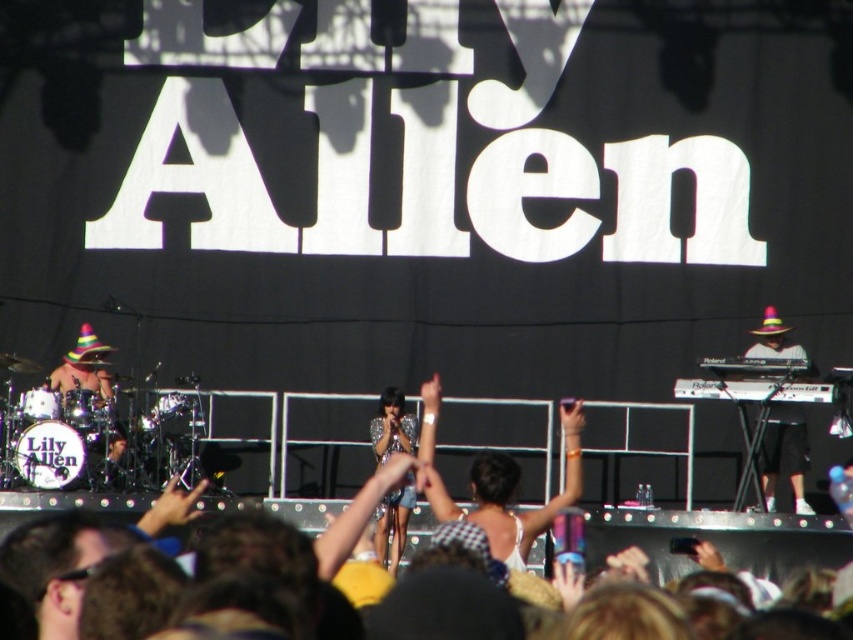
Between purple felt hat at right and sparkly silver dress at center, which one has less height?

purple felt hat at right is shorter.

Does purple felt hat at right have a greater height compared to sparkly silver dress at center?

No, purple felt hat at right is not taller than sparkly silver dress at center.

Identify the location of purple felt hat at right. (785, 452).

Does white fabric dress at center appear under purple felt hat at right?

Yes.

Measure the distance between white fabric dress at center and purple felt hat at right.

white fabric dress at center is 26.86 feet from purple felt hat at right.

Image resolution: width=853 pixels, height=640 pixels. What are the coordinates of `white fabric dress at center` in the screenshot? It's located at [497, 483].

You are a GUI agent. You are given a task and a screenshot of the screen. Output one action in this format:
    pyautogui.click(x=<x>, y=<y>)
    Task: Click on the white fabric dress at center
    This screenshot has height=640, width=853.
    Given the screenshot: What is the action you would take?
    pyautogui.click(x=497, y=483)

Looking at this image, who is more distant from viewer, (430, 506) or (407, 435)?

Point (407, 435)

I want to click on white fabric dress at center, so click(x=497, y=483).